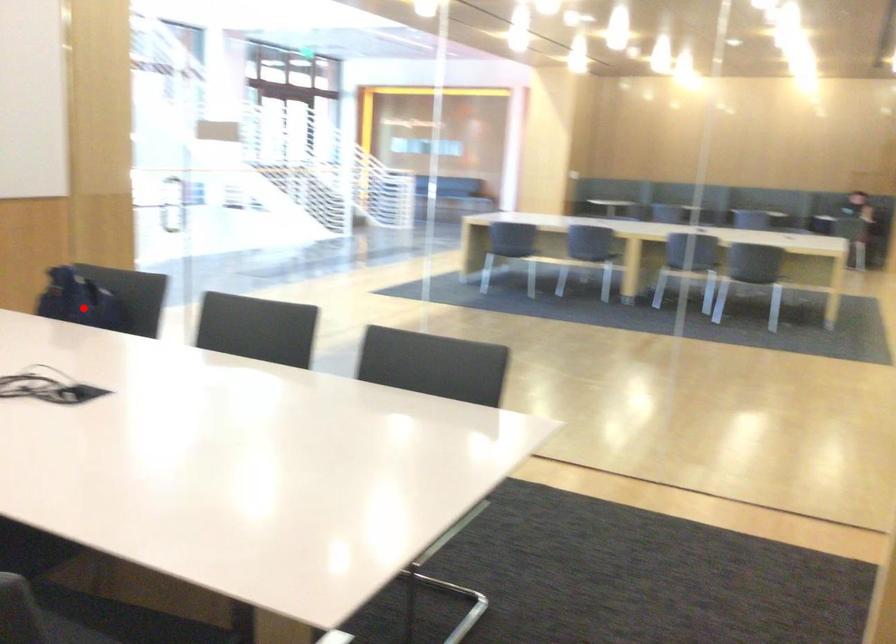
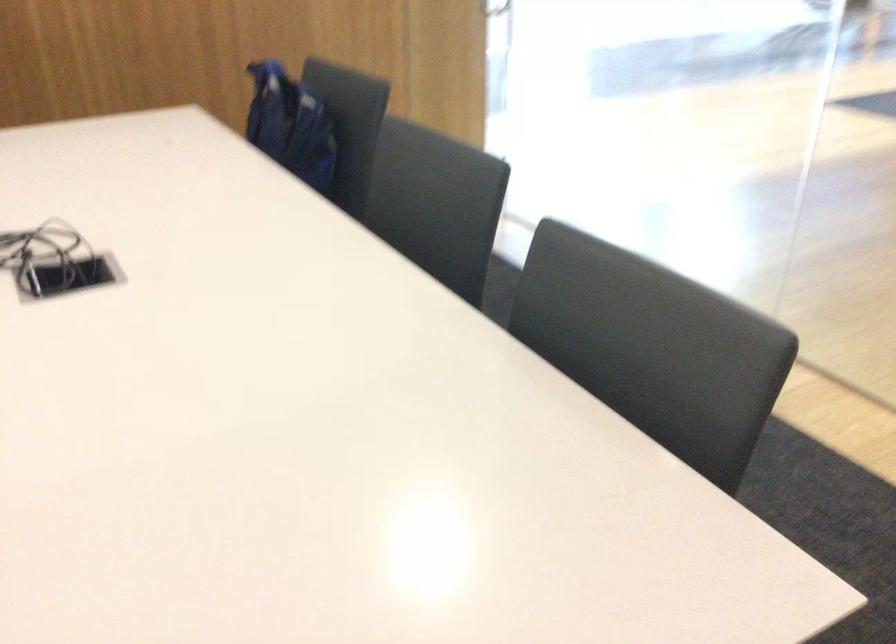
Question: I am providing you with two images of the same scene from different viewpoints. A red point is marked on the first image. At the location where the point appears in image 1, is it still visible in image 2?

Choices:
 (A) Yes
 (B) No

Answer: (A)